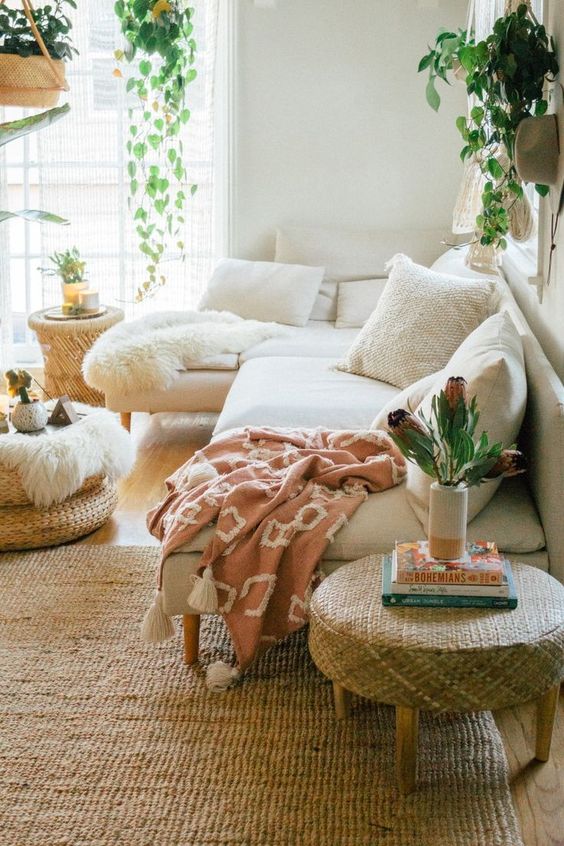
Where is `carpet`? Image resolution: width=564 pixels, height=846 pixels. carpet is located at coordinates (73, 663), (210, 761), (279, 788), (126, 784), (87, 702).